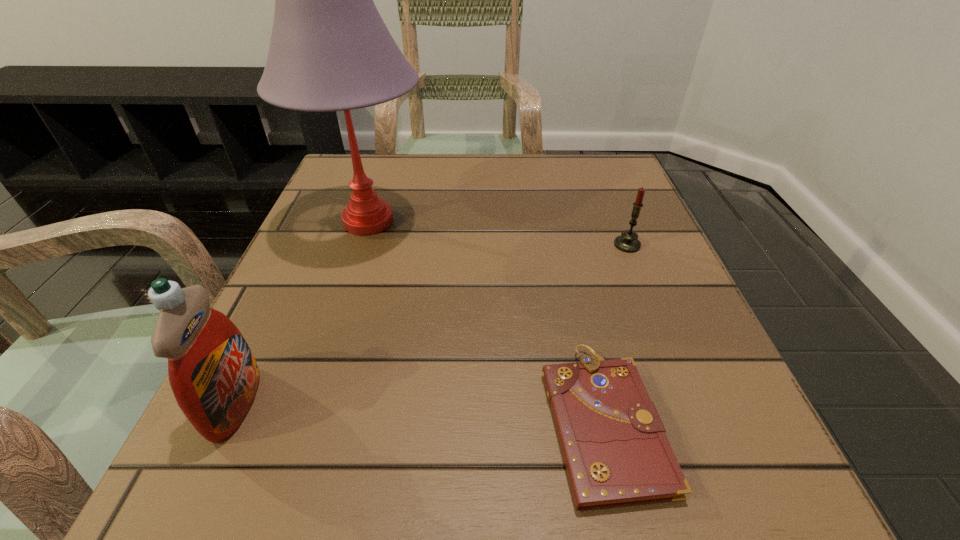
This screenshot has width=960, height=540. Find the location of `free space at the far edge of the desktop`. free space at the far edge of the desktop is located at coordinates (548, 190).

The height and width of the screenshot is (540, 960). Identify the location of vacant space at the near edge. (519, 522).

Identify the location of free space at the left edge of the desktop. (298, 354).

In the image, there is a desktop. At what (x,y) coordinates should I click in order to perform the action: click on vacant space at the right edge. Please return your answer as a coordinate pair (x, y). Looking at the image, I should click on (648, 269).

This screenshot has height=540, width=960. What are the coordinates of `free spot at the far left corner of the desktop` in the screenshot? It's located at (363, 159).

Find the location of `free spot at the far right corner of the desktop`. free spot at the far right corner of the desktop is located at coordinates (566, 188).

Identify the location of unoccupied area between the second tallest object and the rightmost object. (431, 324).

Image resolution: width=960 pixels, height=540 pixels. Find the location of `vacant area that lies between the tallest object and the detergent`. vacant area that lies between the tallest object and the detergent is located at coordinates (301, 312).

Where is `vacant space that's between the second tallest object and the table lamp`? This screenshot has width=960, height=540. vacant space that's between the second tallest object and the table lamp is located at coordinates click(x=301, y=312).

The image size is (960, 540). What are the coordinates of `free space between the tallest object and the rightmost object` in the screenshot? It's located at (497, 233).